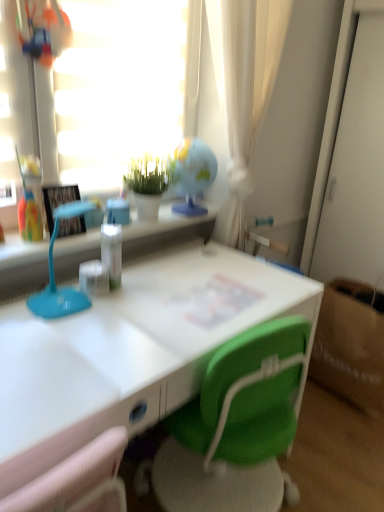
What do you see at coordinates (131, 351) in the screenshot?
I see `white glossy desk at center` at bounding box center [131, 351].

Locate an element on the screen. The image size is (384, 512). brown paper bag at lower right is located at coordinates (351, 344).

Locate an element on the screen. Image resolution: width=384 pixels, height=512 pixels. matte black picture frame at left is located at coordinates (58, 200).

Measure the distance between point (141, 196) and camera.

The depth of point (141, 196) is 5.18 feet.

What are the coordinates of `white glossy desk at center` in the screenshot? It's located at (131, 351).

How different are the orientations of transparent glass globe at upper center and brown paper bag at lower right in degrees?

They differ by 90.6 degrees in their facing directions.

Between transparent glass globe at upper center and brown paper bag at lower right, which one has larger size?

brown paper bag at lower right.

Based on the photo, is transparent glass globe at upper center closer to camera compared to brown paper bag at lower right?

That is True.

Consider the image. Is brown paper bag at lower right a part of transparent glass globe at upper center?

Actually, brown paper bag at lower right is outside transparent glass globe at upper center.

Is brown paper bag at lower right bigger or smaller than green matte plant at upper center?

Considering their sizes, brown paper bag at lower right takes up more space than green matte plant at upper center.

Based on the photo, can you confirm if brown paper bag at lower right is thinner than green matte plant at upper center?

Incorrect, the width of brown paper bag at lower right is not less than that of green matte plant at upper center.

From the image's perspective, is brown paper bag at lower right located beneath green matte plant at upper center?

Yes.

From the picture: Is there a large distance between white glossy desk at center and brown paper bag at lower right?

white glossy desk at center is near brown paper bag at lower right, not far away.

Based on the photo, is white glossy desk at center inside the boundaries of brown paper bag at lower right, or outside?

white glossy desk at center is outside brown paper bag at lower right.

From the picture: How many degrees apart are the facing directions of white glossy desk at center and brown paper bag at lower right?

91.6 degrees separate the facing orientations of white glossy desk at center and brown paper bag at lower right.

Which of these two, white glossy desk at center or brown paper bag at lower right, stands taller?

white glossy desk at center is taller.

Is matte black picture frame at left located outside green matte plant at upper center?

Yes, matte black picture frame at left is outside of green matte plant at upper center.

Is matte black picture frame at left closer to the viewer compared to green matte plant at upper center?

Yes, matte black picture frame at left is closer to the viewer.

Who is bigger, matte black picture frame at left or green matte plant at upper center?

green matte plant at upper center.

The image size is (384, 512). What are the coordinates of `picture frame on the left of green matte plant at upper center` in the screenshot? It's located at (58, 200).

Could you tell me if transparent glass globe at upper center is turned towards white glossy desk at center?

No, transparent glass globe at upper center is not aimed at white glossy desk at center.

Is transparent glass globe at upper center to the right of white glossy desk at center from the viewer's perspective?

Incorrect, transparent glass globe at upper center is not on the right side of white glossy desk at center.

You are a GUI agent. You are given a task and a screenshot of the screen. Output one action in this format:
    pyautogui.click(x=<x>, y=<y>)
    Task: Click on the window screen above the white glossy desk at center (from a real-world perspective)
    Image resolution: width=384 pixels, height=512 pixels.
    Given the screenshot: What is the action you would take?
    pyautogui.click(x=119, y=88)

Does transparent glass globe at upper center have a lesser height compared to white glossy desk at center?

Indeed, transparent glass globe at upper center has a lesser height compared to white glossy desk at center.

Locate an element on the screen. The height and width of the screenshot is (512, 384). cardboard box located behind the matte black picture frame at left is located at coordinates (351, 344).

Is brown paper bag at lower right to the left or to the right of matte black picture frame at left in the image?

brown paper bag at lower right is to the right of matte black picture frame at left.

How different are the orientations of brown paper bag at lower right and matte black picture frame at left in degrees?

There is a 91.1-degree angle between the facing directions of brown paper bag at lower right and matte black picture frame at left.

Is brown paper bag at lower right located outside matte black picture frame at left?

brown paper bag at lower right lies outside matte black picture frame at left's area.

Would you consider brown paper bag at lower right to be distant from white glossy desk at center?

Actually, brown paper bag at lower right and white glossy desk at center are a little close together.

From a real-world perspective, is brown paper bag at lower right physically located above or below white glossy desk at center?

Clearly, from a real-world perspective, brown paper bag at lower right is below white glossy desk at center.

Between point (375, 339) and point (239, 288), which one is positioned in front?

The point (239, 288) is closer to the camera.

Considering the sizes of brown paper bag at lower right and white glossy desk at center in the image, is brown paper bag at lower right wider or thinner than white glossy desk at center?

Considering their sizes, brown paper bag at lower right looks slimmer than white glossy desk at center.

This screenshot has width=384, height=512. What are the coordinates of `window screen in front of the brown paper bag at lower right` in the screenshot? It's located at (119, 88).

This screenshot has height=512, width=384. I want to click on cardboard box below the green matte plant at upper center (from a real-world perspective), so click(x=351, y=344).

From the image, which object appears to be nearer to matte black picture frame at left, white glossy desk at center or transparent glass globe at upper center?

transparent glass globe at upper center is positioned closer to the anchor matte black picture frame at left.

Which object lies further to the anchor point clear plastic bottle at center, transparent glass globe at upper center or brown paper bag at lower right?

Among the two, brown paper bag at lower right is located further to clear plastic bottle at center.

Estimate the real-world distances between objects in this image. Which object is further from green matte plant at upper center, brown paper bag at lower right or matte black picture frame at left?

brown paper bag at lower right lies further to green matte plant at upper center than the other object.

Estimate the real-world distances between objects in this image. Which object is closer to matte black picture frame at left, clear plastic bottle at center or transparent glass globe at upper center?

Among the two, clear plastic bottle at center is located nearer to matte black picture frame at left.

Which object lies nearer to the anchor point clear plastic bottle at center, brown paper bag at lower right or green matte plant at upper center?

green matte plant at upper center lies closer to clear plastic bottle at center than the other object.

Based on their spatial positions, is green matte plant at upper center or matte black picture frame at left closer to transparent glass globe at upper center?

green matte plant at upper center lies closer to transparent glass globe at upper center than the other object.

When comparing their distances from green matte plant at upper center, does matte black picture frame at left or clear plastic bottle at center seem closer?

The object closer to green matte plant at upper center is clear plastic bottle at center.

Estimate the real-world distances between objects in this image. Which object is closer to brown paper bag at lower right, clear plastic bottle at center or white glossy desk at center?

white glossy desk at center is positioned closer to the anchor brown paper bag at lower right.

Where is `window screen between matte black picture frame at left and brown paper bag at lower right from left to right`? window screen between matte black picture frame at left and brown paper bag at lower right from left to right is located at coordinates (119, 88).

This screenshot has height=512, width=384. I want to click on cardboard box between transparent glass globe at upper center and white glossy desk at center in the up-down direction, so click(x=351, y=344).

Find the location of a particular element. This screenshot has width=384, height=512. bottle between matte black picture frame at left and white glossy desk at center from top to bottom is located at coordinates (112, 252).

The height and width of the screenshot is (512, 384). I want to click on houseplant situated between matte black picture frame at left and brown paper bag at lower right from left to right, so click(x=147, y=184).